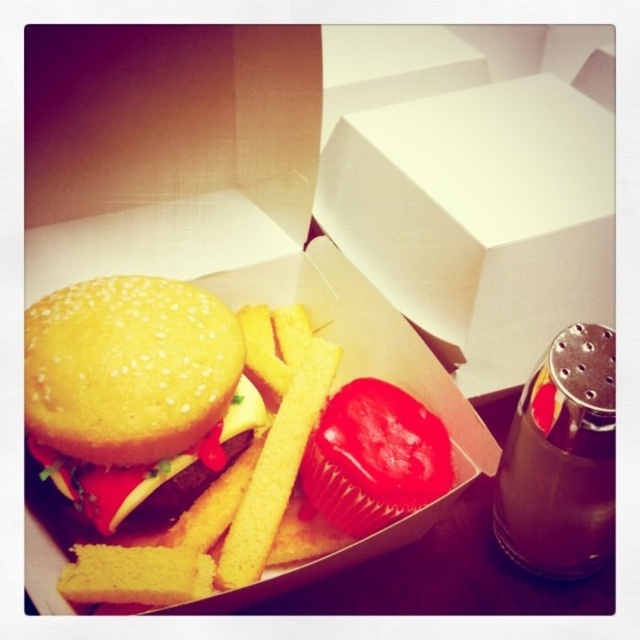
Question: Which point is closer to the camera taking this photo?

Choices:
 (A) (216, 497)
 (B) (417, 104)
 (C) (580, 442)

Answer: (C)

Question: Is semi-glossy yellow bun at center positioned behind yellow crispy french fries at center?

Choices:
 (A) yes
 (B) no

Answer: (A)

Question: Which of these objects is positioned farthest from the white cardboard box at center?

Choices:
 (A) black plastic salt shaker at right
 (B) yellow crispy french fries at center

Answer: (B)

Question: Is white cardboard box at center positioned behind yellow crispy french fries at center?

Choices:
 (A) yes
 (B) no

Answer: (A)

Question: Which object appears closest to the camera in this image?

Choices:
 (A) black plastic salt shaker at right
 (B) semi-glossy yellow bun at center

Answer: (A)

Question: Does semi-glossy yellow bun at center have a larger size compared to black plastic salt shaker at right?

Choices:
 (A) yes
 (B) no

Answer: (A)